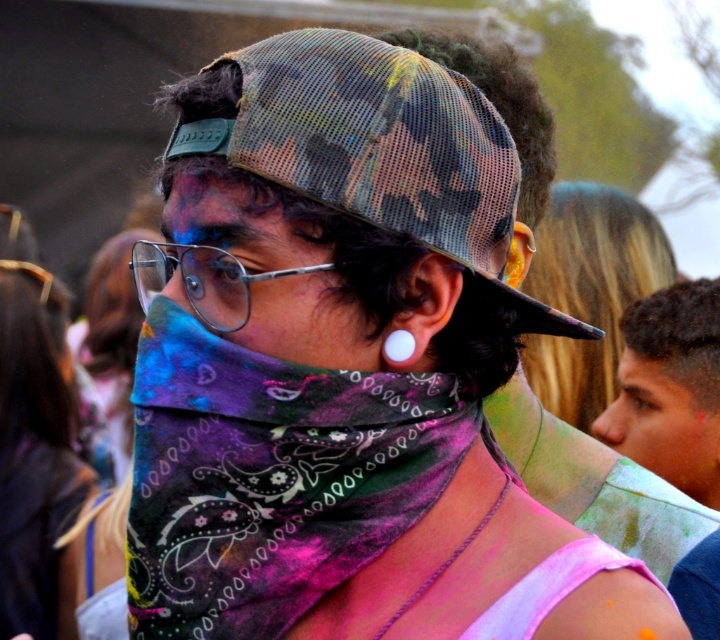
Question: Estimate the real-world distances between objects in this image. Which object is closer to the multicolored bandana at center?

Choices:
 (A) camo mesh cap at center
 (B) silver metallic glasses at center

Answer: (B)

Question: Which point is closer to the camera taking this photo?

Choices:
 (A) (320, 342)
 (B) (702, 426)
 (C) (481, 125)

Answer: (A)

Question: Estimate the real-world distances between objects in this image. Which object is farther from the multicolored bandana at center?

Choices:
 (A) camo mesh cap at center
 (B) multicolored paisley bandana at center

Answer: (B)

Question: Can you confirm if multicolored paisley bandana at center is wider than camo mesh cap at center?

Choices:
 (A) yes
 (B) no

Answer: (B)

Question: Is multicolored paisley bandana at center smaller than smooth skin face at right?

Choices:
 (A) yes
 (B) no

Answer: (B)

Question: From the image, what is the correct spatial relationship of multicolored bandana at center in relation to smooth skin face at right?

Choices:
 (A) right
 (B) left

Answer: (B)